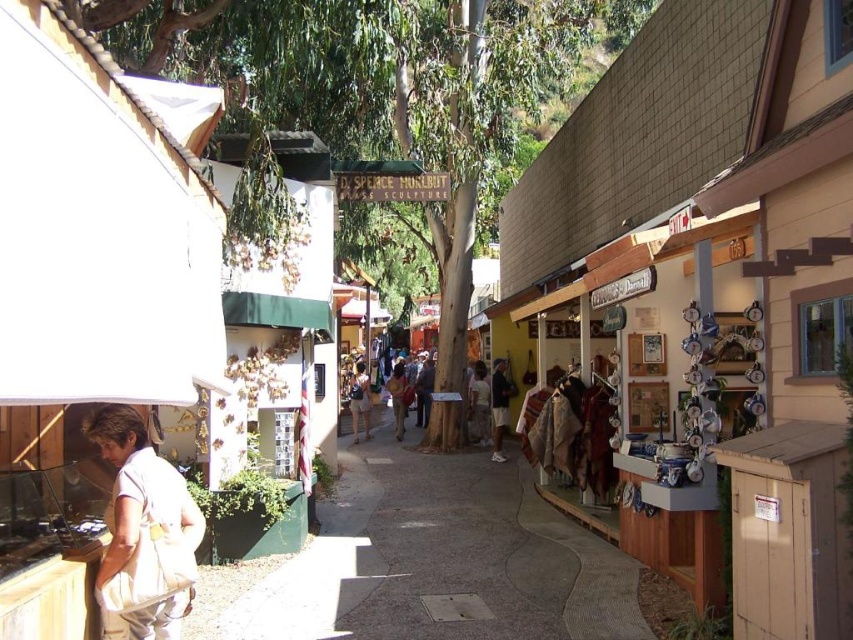
Is point (494, 369) closer to camera compared to point (421, 376)?

Yes, it is.

Does dark blue jeans at center appear under matte black jacket at center?

Incorrect, dark blue jeans at center is not positioned below matte black jacket at center.

Image resolution: width=853 pixels, height=640 pixels. Identify the location of dark blue jeans at center. (498, 406).

The image size is (853, 640). Identify the location of dark blue jeans at center. (498, 406).

Measure the distance between concrete sidewalk at center and camera.

They are 5.31 meters apart.

Does concrete sidewalk at center have a greater height compared to matte black jacket at center?

In fact, concrete sidewalk at center may be shorter than matte black jacket at center.

Which is in front, point (421, 564) or point (426, 371)?

Point (421, 564)

Identify the location of concrete sidewalk at center. This screenshot has width=853, height=640. (440, 561).

Where is `concrete sidewalk at center`? concrete sidewalk at center is located at coordinates (440, 561).